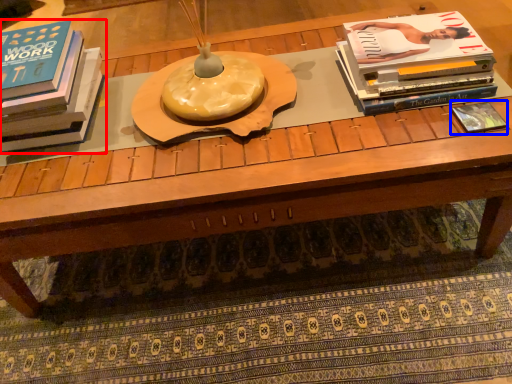
Question: Which object is closer to the camera taking this photo, book (highlighted by a red box) or book (highlighted by a blue box)?

Choices:
 (A) book
 (B) book

Answer: (A)